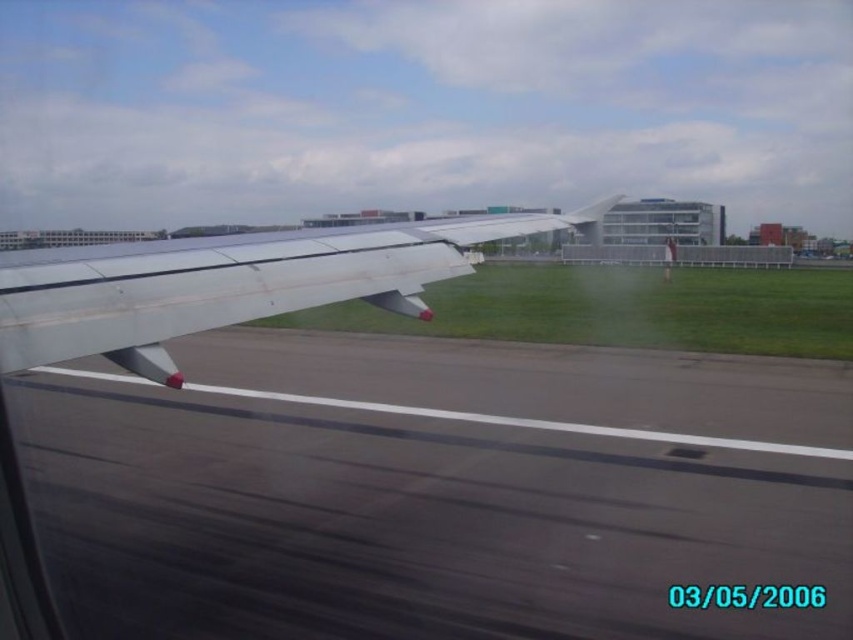
Measure the distance between gray asphalt runway at lower left and metallic silver wing at left.

A distance of 2.33 meters exists between gray asphalt runway at lower left and metallic silver wing at left.

At what (x,y) coordinates should I click in order to perform the action: click on gray asphalt runway at lower left. Please return your answer as a coordinate pair (x, y). The height and width of the screenshot is (640, 853). Looking at the image, I should click on (434, 490).

Does point (505, 422) come behind point (225, 292)?

Yes, point (505, 422) is behind point (225, 292).

Where is `gray asphalt runway at lower left`? This screenshot has width=853, height=640. gray asphalt runway at lower left is located at coordinates (434, 490).